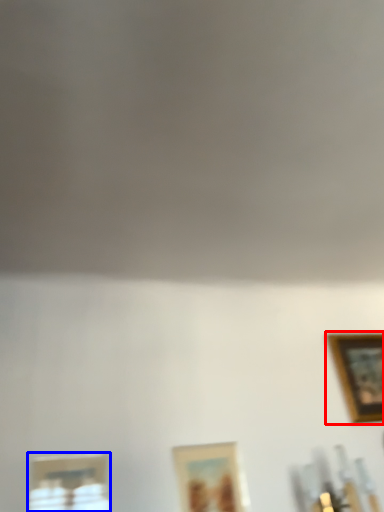
Question: Which object is closer to the camera taking this photo, picture frame (highlighted by a red box) or picture frame (highlighted by a blue box)?

Choices:
 (A) picture frame
 (B) picture frame

Answer: (B)